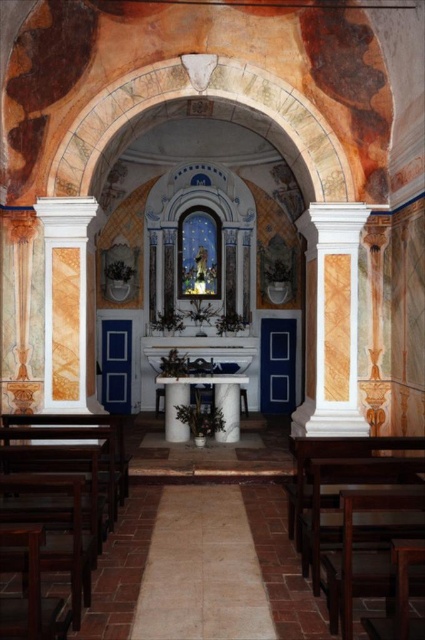
Question: Which point is farther to the camera?

Choices:
 (A) white marble column at right
 (B) white marble column at left

Answer: (A)

Question: Can you confirm if white marble column at right is wider than white marble column at left?

Choices:
 (A) yes
 (B) no

Answer: (A)

Question: Which of the following is the farthest from the observer?

Choices:
 (A) white marble column at right
 (B) white marble column at left

Answer: (A)

Question: Is white marble column at right positioned behind white marble column at left?

Choices:
 (A) no
 (B) yes

Answer: (B)

Question: Is white marble column at right to the left of white marble column at left from the viewer's perspective?

Choices:
 (A) yes
 (B) no

Answer: (B)